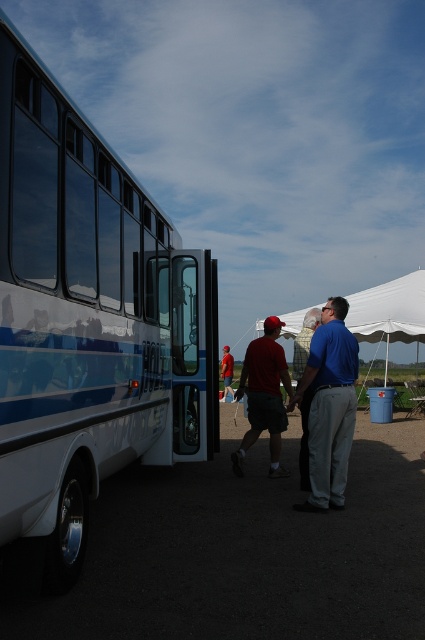
Who is more distant from viewer, (382, 324) or (295, 364)?

Positioned behind is point (382, 324).

Is white fabric canopy at center closer to the viewer compared to blue fabric shirt at center?

No, white fabric canopy at center is further to the viewer.

Identify the location of white fabric canopy at center. Image resolution: width=425 pixels, height=640 pixels. (390, 310).

Is white glossy bus at left in front of matte red cap at center?

Yes, white glossy bus at left is closer to the viewer.

Which is more to the left, white glossy bus at left or matte red cap at center?

white glossy bus at left

Locate an element on the screen. The height and width of the screenshot is (640, 425). white glossy bus at left is located at coordinates (88, 317).

Does blue smooth shirt at center have a greater width compared to white fabric canopy at center?

In fact, blue smooth shirt at center might be narrower than white fabric canopy at center.

Who is more distant from viewer, (328, 307) or (377, 289)?

The point (377, 289) is more distant.

This screenshot has width=425, height=640. I want to click on blue smooth shirt at center, so click(329, 406).

You are a GUI agent. You are given a task and a screenshot of the screen. Output one action in this format:
    pyautogui.click(x=<x>, y=<y>)
    Task: Click on the blue smooth shirt at center
    Image resolution: width=425 pixels, height=640 pixels.
    Given the screenshot: What is the action you would take?
    pyautogui.click(x=329, y=406)